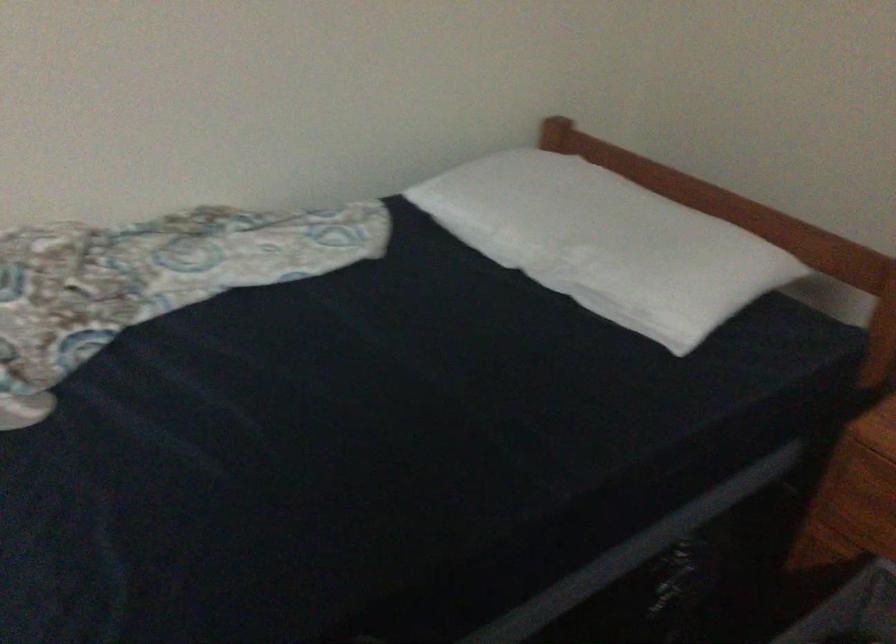
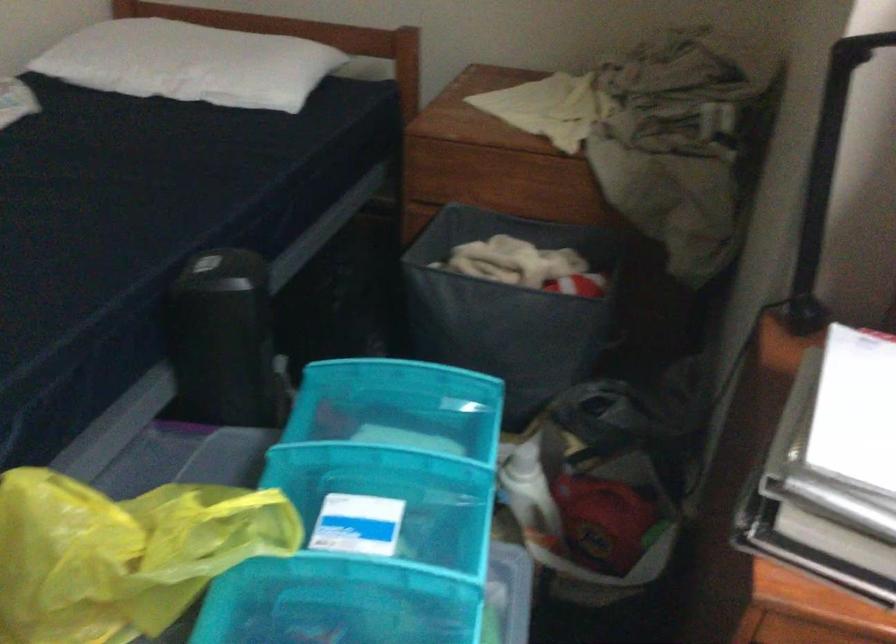
Locate, in the second image, the point that corresponds to (578,243) in the first image.

(191, 62)